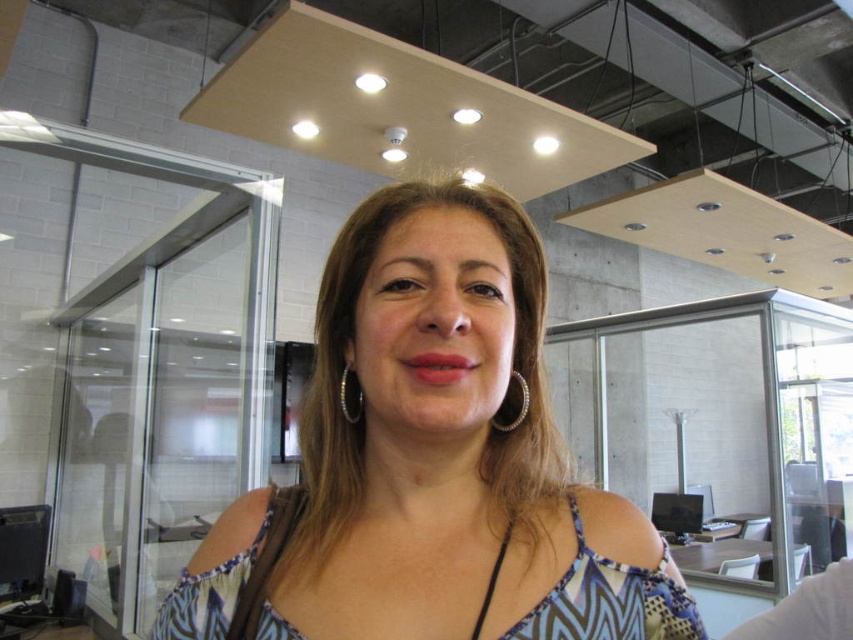
You are a photographer trying to capture a closeup of the person in the office. You want to focus on the silver metallic earring at center and the gold textured hoop at center. Which earring should you adjust your camera to the right to capture better?

The gold textured hoop at center is to the right of the silver metallic earring at center, so to focus on the gold textured hoop at center, you should adjust your camera to the right. However, if you want to focus on the silver metallic earring at center, you don not need to move the camera to the right since it is positioned to the left of the gold textured hoop at center.

You are a photographer setting up a shoot in this office space. You need to place a matte blue dress at center and a silver metallic earring at center in a way that the dress is visible without being blocked. Based on their current positions, is the dress currently visible beneath the earring?

The matte blue dress at center is positioned under the silver metallic earring at center, so the dress may be partially or fully blocked by the earring, making it less visible. Adjust their positions to ensure the dress is not obstructed.